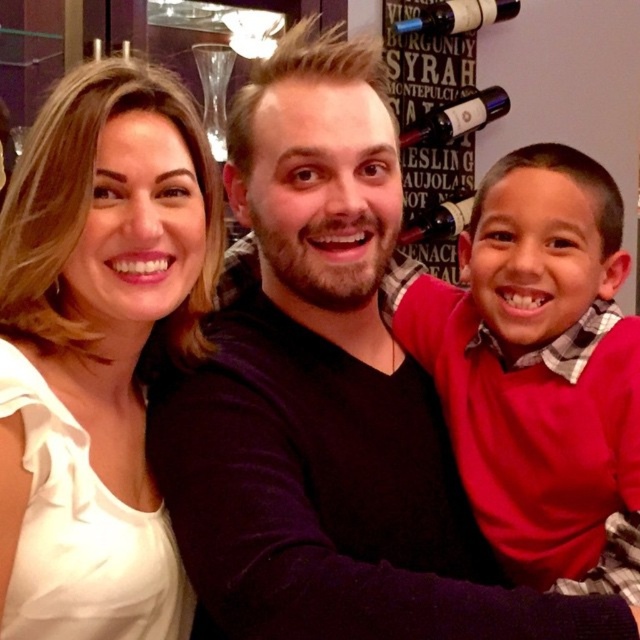
Question: Does matte glass wine bottle at upper right appear over dark brown glass bottle at center?

Choices:
 (A) yes
 (B) no

Answer: (A)

Question: Is matte glass wine bottle at upper right bigger than dark brown glass bottle at center?

Choices:
 (A) no
 (B) yes

Answer: (B)

Question: Observing the image, what is the correct spatial positioning of clear glass wine glass at upper center in reference to dark brown glass bottle at center?

Choices:
 (A) above
 (B) below

Answer: (A)

Question: Which of the following is the closest to the observer?

Choices:
 (A) dark brown glass bottle at center
 (B) matte burgundy wine bottle at upper right
 (C) red matte sweater at right
 (D) matte glass wine bottle at upper right

Answer: (C)

Question: Which point is farther to the camera?

Choices:
 (A) (205, 67)
 (B) (60, 173)

Answer: (A)

Question: Which point is closer to the camera?

Choices:
 (A) matte burgundy wine bottle at upper right
 (B) clear glass wine glass at upper center
 (C) dark brown glass bottle at center
 (D) white satin blouse at upper left

Answer: (D)